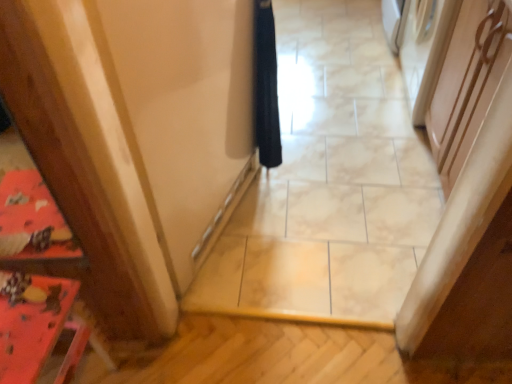
Describe the element at coordinates (467, 82) in the screenshot. I see `wooden cabinet at right` at that location.

This screenshot has height=384, width=512. Find the location of `wooden cabinet at right`. wooden cabinet at right is located at coordinates (467, 82).

Looking at this image, measure the distance between wooden cabinet at right and camera.

A distance of 3.52 feet exists between wooden cabinet at right and camera.

Where is `wooden cabinet at right`? wooden cabinet at right is located at coordinates (467, 82).